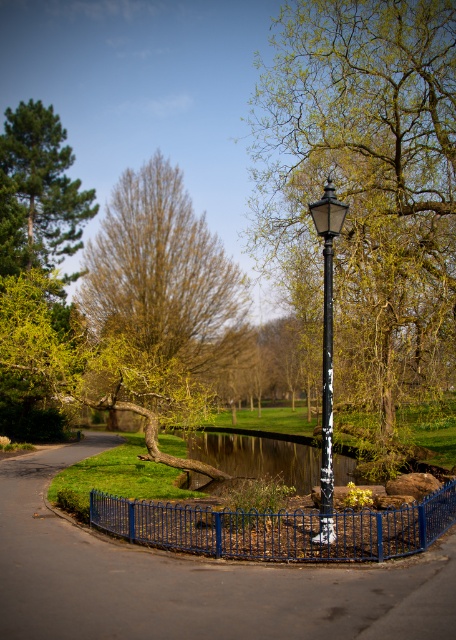
Can you confirm if black metal fence at center is bigger than black metal street light at center?

Yes, black metal fence at center is bigger than black metal street light at center.

Who is higher up, black metal fence at center or black metal street light at center?

Positioned higher is black metal street light at center.

Locate an element on the screen. This screenshot has height=640, width=456. black metal fence at center is located at coordinates (193, 580).

Which is below, green leafy tree at center or blue metal fence at center?

blue metal fence at center

Between green leafy tree at center and blue metal fence at center, which one appears on the right side from the viewer's perspective?

Positioned to the right is green leafy tree at center.

Where is `green leafy tree at center`? Image resolution: width=456 pixels, height=640 pixels. green leafy tree at center is located at coordinates (364, 186).

Locate an element on the screen. green leafy tree at center is located at coordinates (364, 186).

Is point (47, 529) closer to camera compared to point (388, 525)?

No.

Is black metal fence at center below blue metal fence at center?

Indeed, black metal fence at center is positioned under blue metal fence at center.

Is point (10, 609) positioned after point (383, 524)?

No, it is not.

Image resolution: width=456 pixels, height=640 pixels. Find the location of `black metal fence at center`. black metal fence at center is located at coordinates (193, 580).